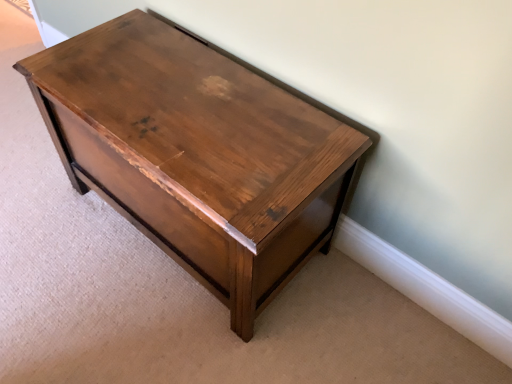
What are the coordinates of `shiny brown wood chest at center` in the screenshot? It's located at (197, 154).

Measure the distance between shiny brown wood chest at center and camera.

The depth of shiny brown wood chest at center is 33.64 inches.

Describe the element at coordinates (197, 154) in the screenshot. The height and width of the screenshot is (384, 512). I see `shiny brown wood chest at center` at that location.

Image resolution: width=512 pixels, height=384 pixels. Find the location of `shiny brown wood chest at center`. shiny brown wood chest at center is located at coordinates (197, 154).